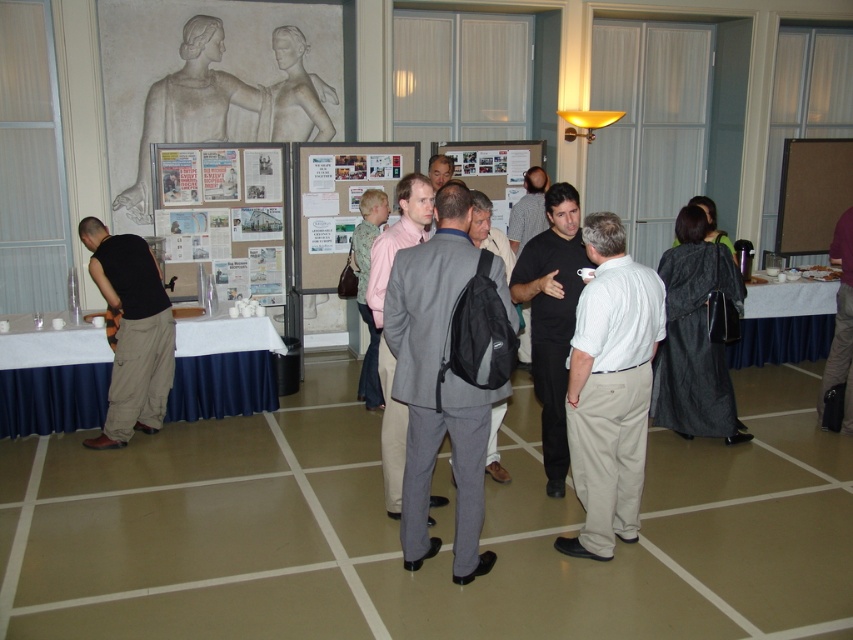
Which of these two, white paper poster at center or black cotton pants at left, stands shorter?

white paper poster at center is shorter.

Is the position of white paper poster at center more distant than that of black cotton pants at left?

Yes, white paper poster at center is behind black cotton pants at left.

Image resolution: width=853 pixels, height=640 pixels. In order to click on white paper poster at center in this screenshot , I will do `click(227, 214)`.

At what (x,y) coordinates should I click in order to perform the action: click on white paper poster at center. Please return your answer as a coordinate pair (x, y). The height and width of the screenshot is (640, 853). Looking at the image, I should click on (227, 214).

Who is positioned more to the right, gray fabric backpack at center or matte gray suit at center?

gray fabric backpack at center

Where is `gray fabric backpack at center`? The width and height of the screenshot is (853, 640). gray fabric backpack at center is located at coordinates (488, 230).

Where is `gray fabric backpack at center`? gray fabric backpack at center is located at coordinates (488, 230).

Does black cotton pants at left appear over gray suit at center?

Correct, black cotton pants at left is located above gray suit at center.

Does black cotton pants at left have a larger size compared to gray suit at center?

Incorrect, black cotton pants at left is not larger than gray suit at center.

Where is `black cotton pants at left`? The image size is (853, 640). black cotton pants at left is located at coordinates (131, 332).